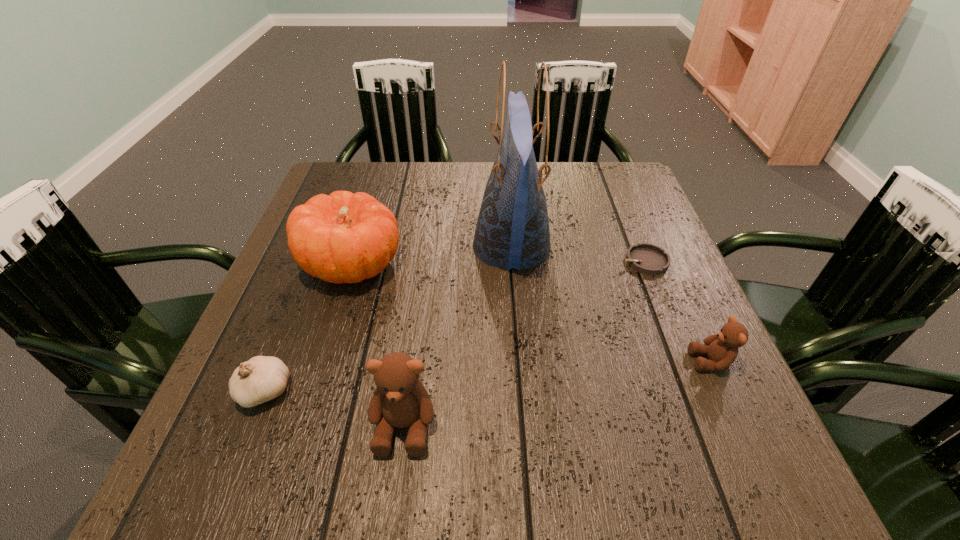
Locate an element on the screen. This screenshot has height=540, width=960. vacant region located 0.170m on the face of the farther teddy bear is located at coordinates (599, 361).

Where is `free location located on the face of the farther teddy bear`? The image size is (960, 540). free location located on the face of the farther teddy bear is located at coordinates (631, 361).

I want to click on free region located on the right of the tallest object, so click(x=592, y=247).

Image resolution: width=960 pixels, height=540 pixels. I want to click on free space located 0.110m on the back of the shortest object, so click(x=628, y=220).

The image size is (960, 540). What are the coordinates of `vacant space located on the front of the pumpkin` in the screenshot? It's located at (304, 418).

You are a GUI agent. You are given a task and a screenshot of the screen. Output one action in this format:
    pyautogui.click(x=<x>, y=<y>)
    Task: Click on the free space located 0.290m on the right of the garlic
    This screenshot has height=540, width=960.
    Given the screenshot: What is the action you would take?
    pyautogui.click(x=458, y=392)

This screenshot has width=960, height=540. I want to click on teddy bear that is at the near edge, so click(x=400, y=400).

Where is `garlic located at the near edge`? The image size is (960, 540). garlic located at the near edge is located at coordinates (262, 378).

Identify the location of pumpkin situated at the left edge. (342, 238).

At what (x,y) coordinates should I click in order to perform the action: click on garlic that is at the left edge. Please return your answer as a coordinate pair (x, y). Looking at the image, I should click on (262, 378).